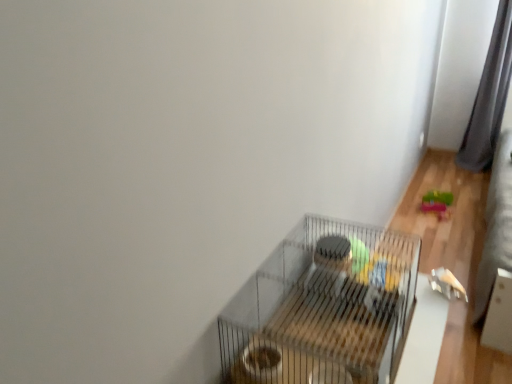
Question: From the image's perspective, relative to gray fabric curtain at right, is metallic wire birdcage at center above or below?

Choices:
 (A) below
 (B) above

Answer: (A)

Question: Is point (278, 316) positioned closer to the camera than point (496, 54)?

Choices:
 (A) closer
 (B) farther

Answer: (A)

Question: Which object is the closest to the rubberized green toy at lower right?

Choices:
 (A) gray fabric curtain at right
 (B) metallic wire birdcage at center

Answer: (A)

Question: Which object is positioned farthest from the rubberized green toy at lower right?

Choices:
 (A) metallic wire birdcage at center
 (B) gray fabric curtain at right

Answer: (A)